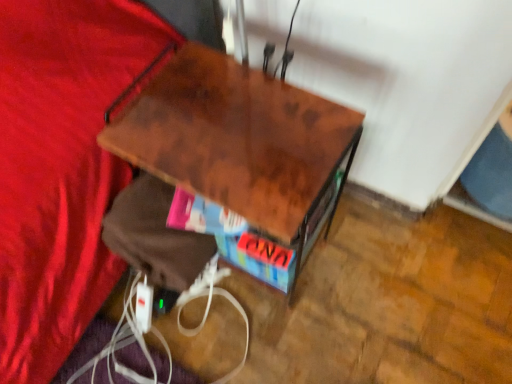
Locate an element on the screen. This screenshot has width=512, height=384. free space in front of wooden desk at center is located at coordinates (267, 342).